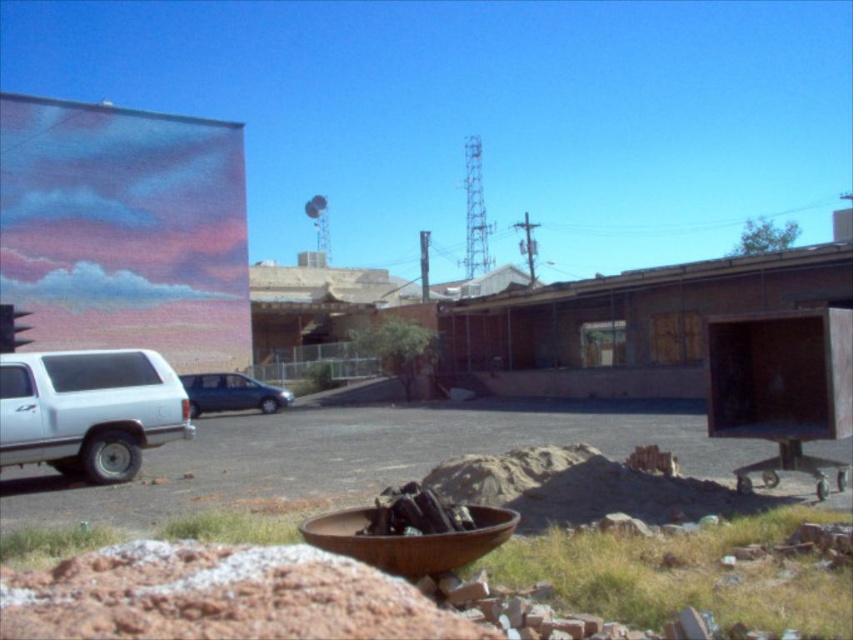
You are standing at the point marked as point (88, 410) in the image. What object is directly in front of you?

The point (88, 410) corresponds to the white matte truck at left, so the white matte truck at left is directly in front of you.

You are a delivery driver who needs to park your vehicle between the white matte truck at left and the satin blue sedan at center. Given that your vehicle is 2 meters wide, can you fit your vehicle in the available space between them?

The white matte truck at left is wider than the satin blue sedan at center. However, the exact width difference isn not provided, so it is impossible to determine if the 2 meter wide vehicle can fit between them without knowing the actual space between the two vehicles.